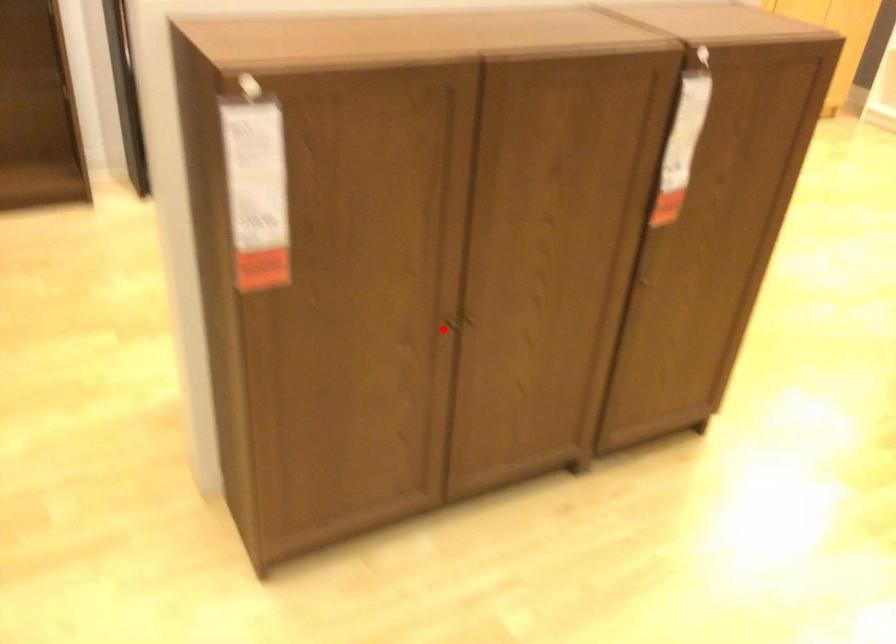
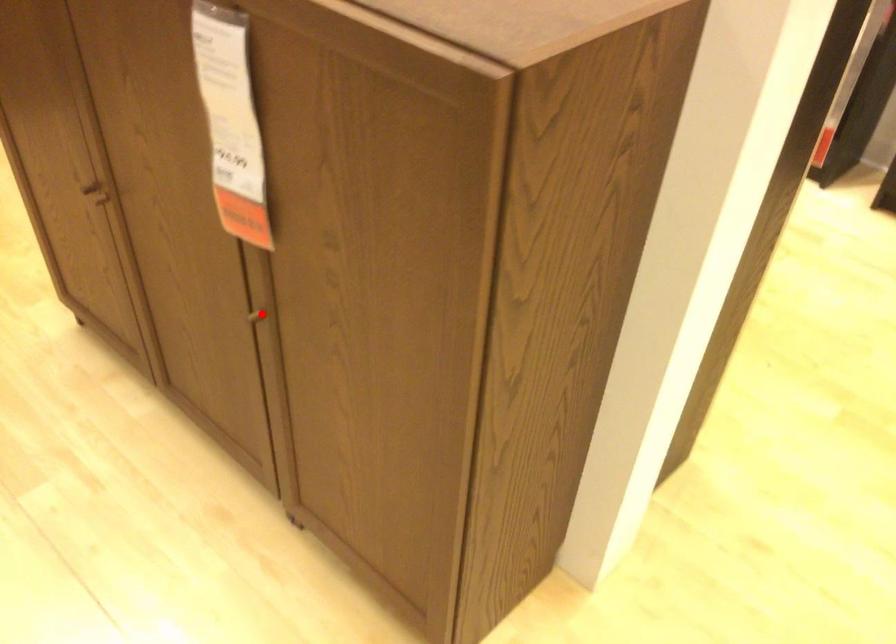
I am providing you with two images of the same scene from different viewpoints. A red point is marked on the first image and another point is marked on the second image. Does the point marked in image1 correspond to the same location as the one in image2?

No